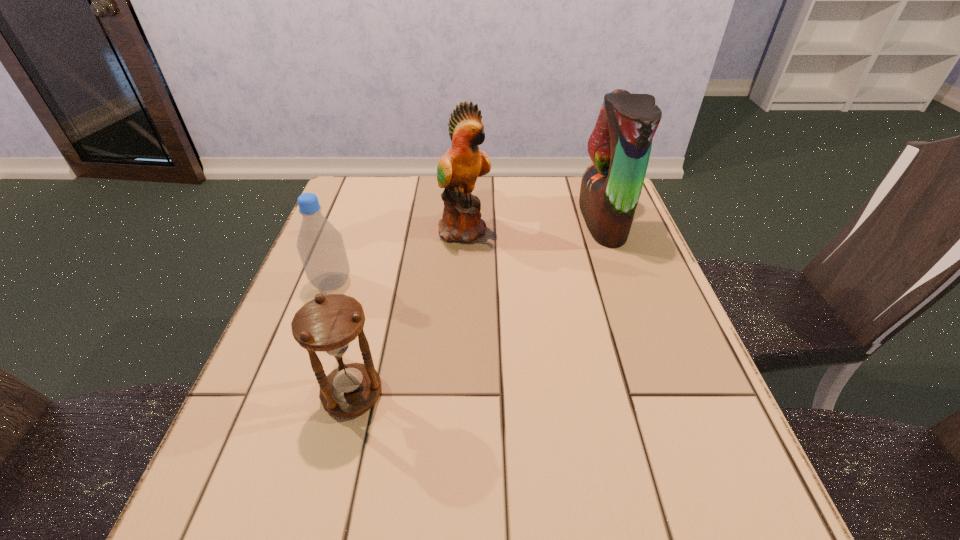
You are a GUI agent. You are given a task and a screenshot of the screen. Output one action in this format:
    pyautogui.click(x=<x>, y=<y>)
    Task: Click on the left parrot
    The width and height of the screenshot is (960, 540).
    Given the screenshot: What is the action you would take?
    (x=458, y=169)

Image resolution: width=960 pixels, height=540 pixels. In order to click on the right parrot in this screenshot , I will do `click(620, 145)`.

Image resolution: width=960 pixels, height=540 pixels. I want to click on bottle, so click(320, 245).

The height and width of the screenshot is (540, 960). I want to click on the leftmost object, so click(x=320, y=245).

You are a GUI agent. You are given a task and a screenshot of the screen. Output one action in this format:
    pyautogui.click(x=<x>, y=<y>)
    Task: Click on the hourglass
    This screenshot has height=540, width=960.
    Given the screenshot: What is the action you would take?
    pyautogui.click(x=329, y=324)

Image resolution: width=960 pixels, height=540 pixels. I want to click on the third object from right to left, so click(x=329, y=324).

The image size is (960, 540). In order to click on free spot located on the front-facing side of the left parrot in this screenshot , I will do `click(592, 229)`.

Find the location of `vacant space located 0.330m at the face of the rightmost object`. vacant space located 0.330m at the face of the rightmost object is located at coordinates (459, 221).

The image size is (960, 540). Identify the location of free space located 0.260m at the face of the rightmost object. (485, 221).

Identify the location of free space located 0.360m at the face of the rightmost object. (448, 221).